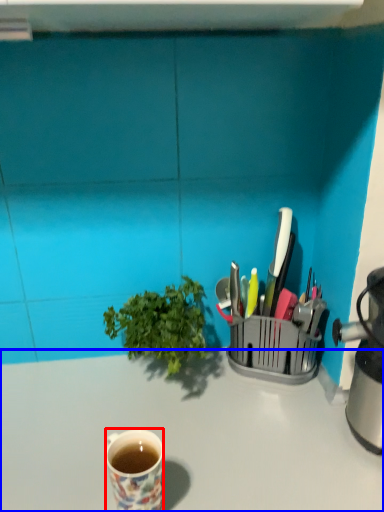
Question: Which point is closer to the camera, coffee cup (highlighted by a red box) or desk (highlighted by a blue box)?

Choices:
 (A) coffee cup
 (B) desk

Answer: (A)